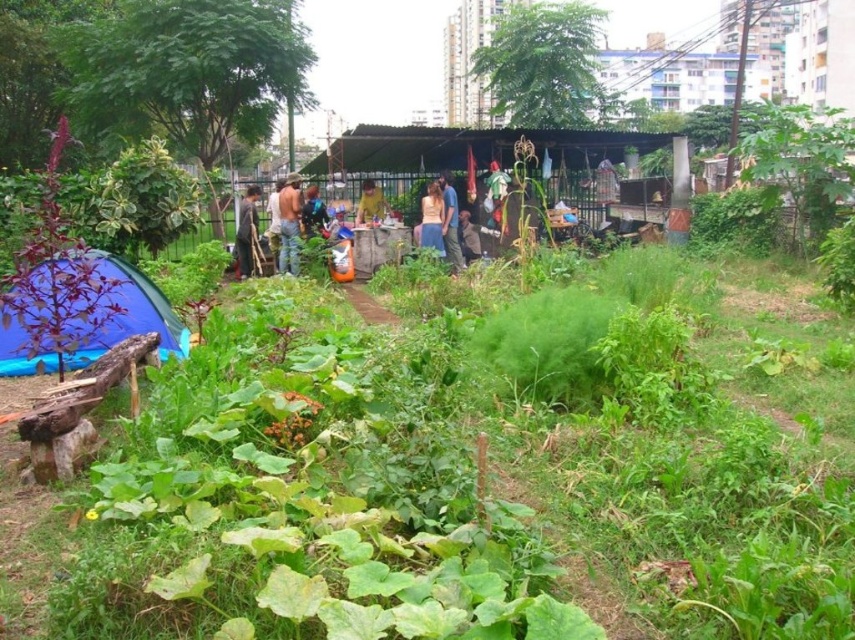
Based on the photo, you are a photographer trying to capture a candid shot of the two people wearing the brown denim pants at center and the light brown fabric shirt at center. Your camera has a maximum focus range of 1.5 meters. Can you capture both subjects in focus without moving your position?

The brown denim pants at center and light brown fabric shirt at center are 1.60 meters apart from each other. Since the camera can only focus within 1.5 meters, it might not be possible to capture both in focus without adjusting your position or using a different lens.

You are a visitor in the community garden and notice two items at the center area. Which one is positioned more to the left between the brown fabric shirt at center and the brown fabric bag at center?

The brown fabric shirt at center is positioned to the left of the brown fabric bag at center, so it is more to the left.